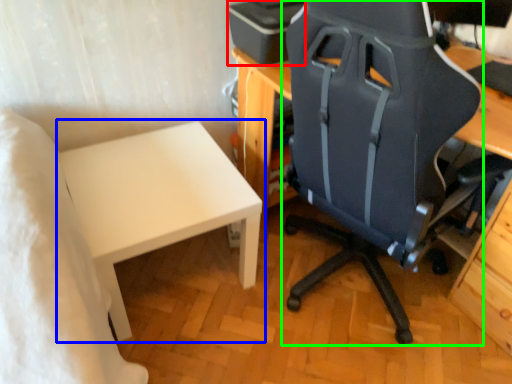
Question: Considering the real-world distances, which object is farthest from printer (highlighted by a red box)? table (highlighted by a blue box) or chair (highlighted by a green box)?

Choices:
 (A) table
 (B) chair

Answer: (A)